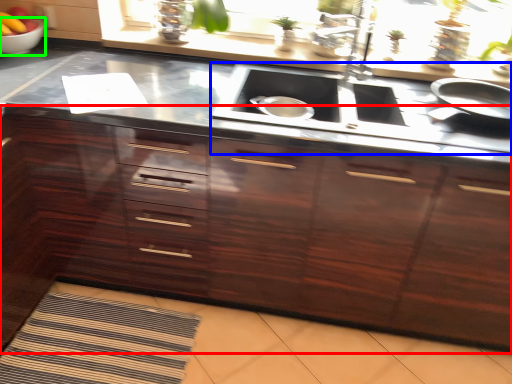
Question: Which object is positioned farthest from cabinetry (highlighted by a red box)? Select from stove (highlighted by a blue box) and mixing bowl (highlighted by a green box).

Choices:
 (A) stove
 (B) mixing bowl

Answer: (B)